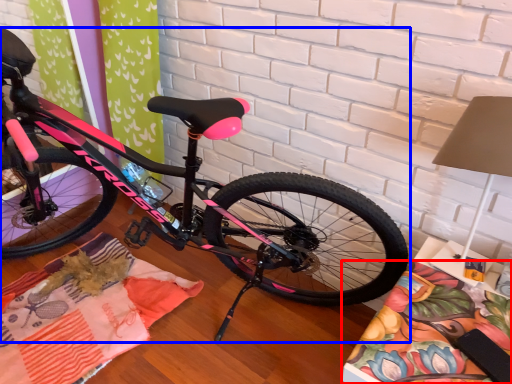
Question: Which point is further to the camera, blanket (highlighted by a red box) or bicycle (highlighted by a blue box)?

Choices:
 (A) blanket
 (B) bicycle

Answer: (A)